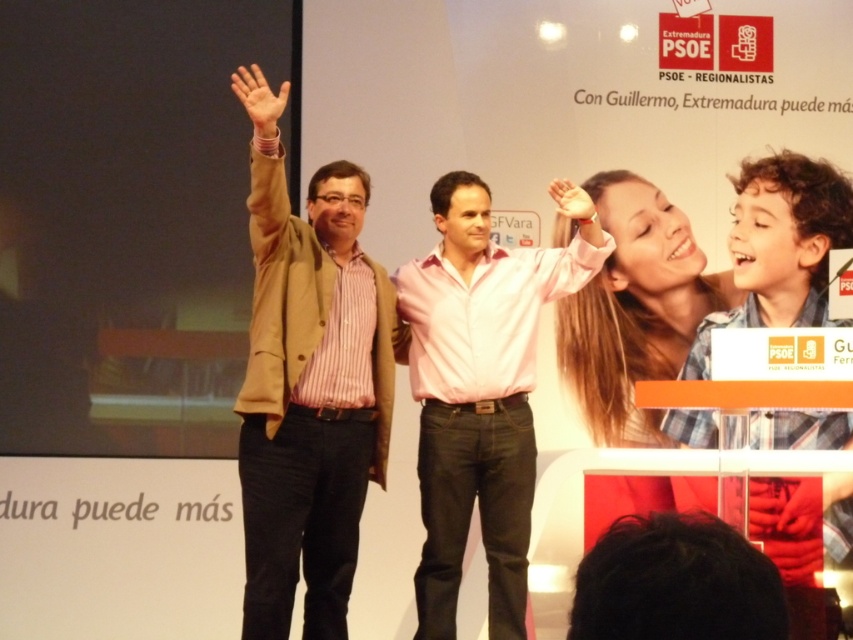
Is matte brown jacket at center to the left of pink cotton shirt at center from the viewer's perspective?

Yes, matte brown jacket at center is to the left of pink cotton shirt at center.

Is point (262, 273) closer to viewer compared to point (583, 269)?

Yes, it is in front of point (583, 269).

Where is `matte brown jacket at center`? matte brown jacket at center is located at coordinates (308, 381).